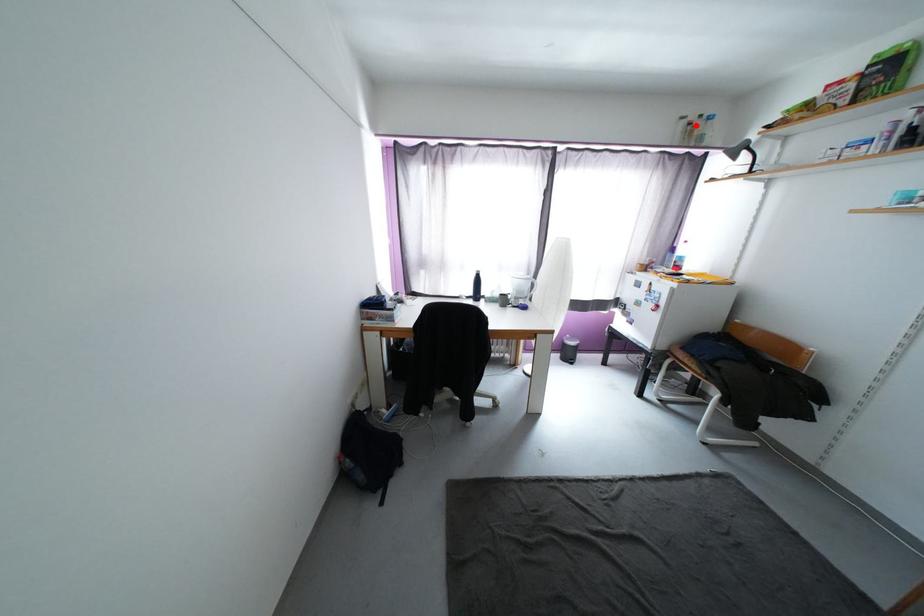
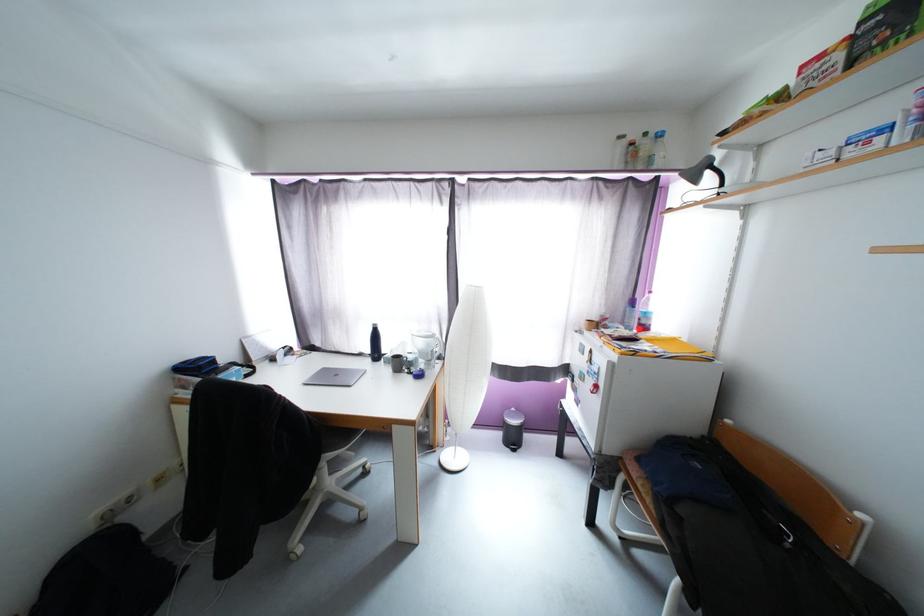
Find the pixel in the second image that matches the highlighted location in the first image.

(638, 146)